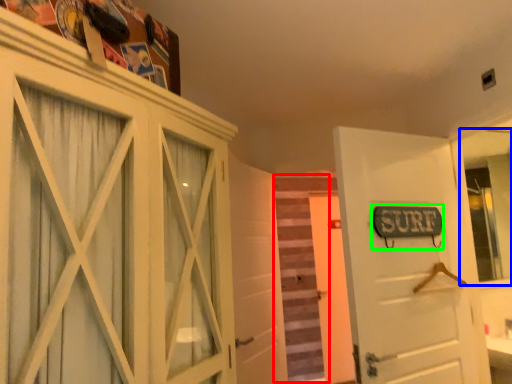
Question: Which object is the farthest from stair (highlighted by a red box)? Choose among these: mirror (highlighted by a blue box) or street sign (highlighted by a green box).

Choices:
 (A) mirror
 (B) street sign

Answer: (B)